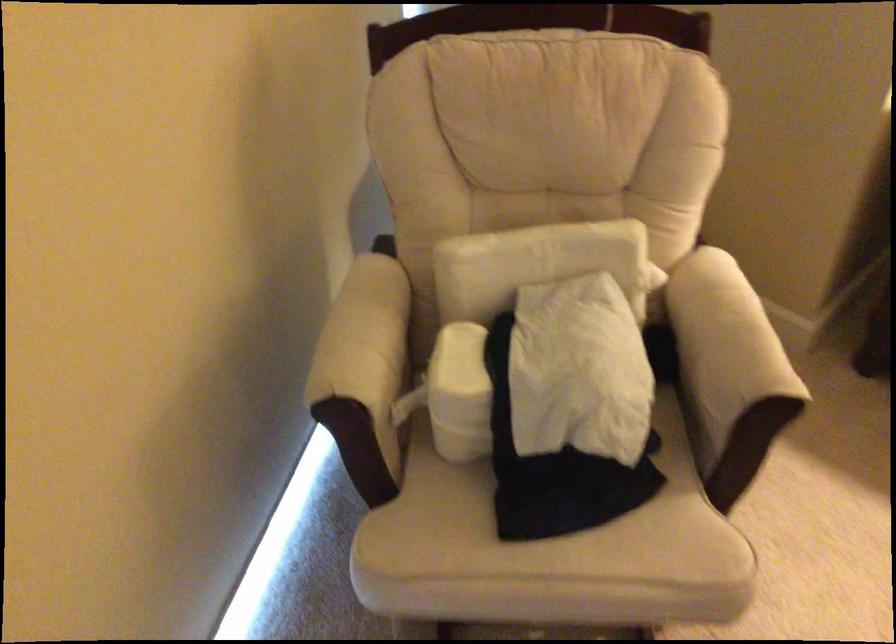
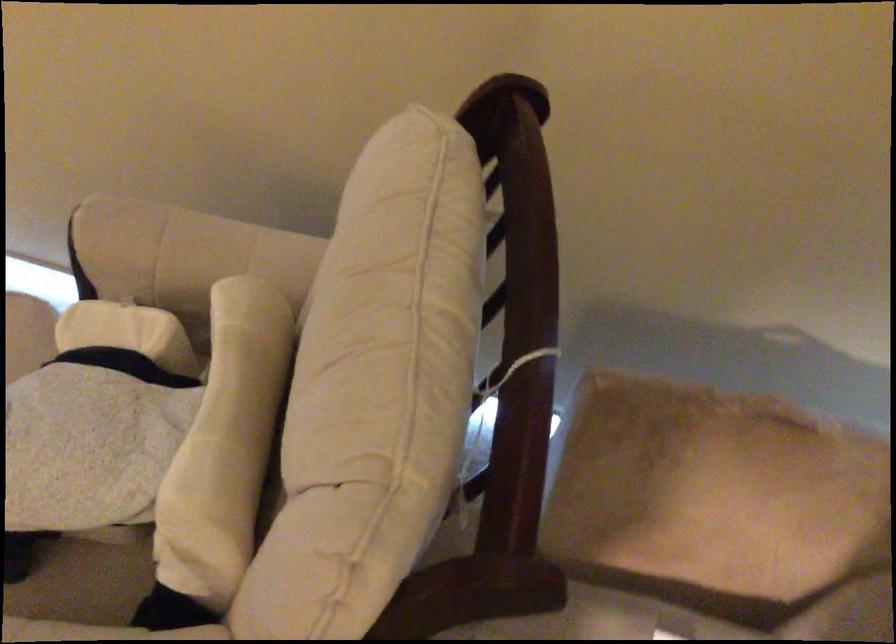
Where in the second image is the point corresponding to (373,335) from the first image?

(181, 250)